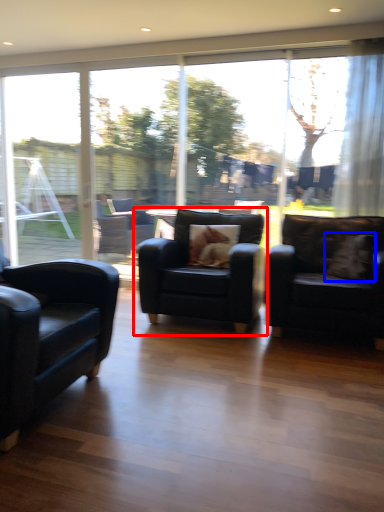
Question: Which object is closer to the camera taking this photo, chair (highlighted by a red box) or pillow (highlighted by a blue box)?

Choices:
 (A) chair
 (B) pillow

Answer: (A)